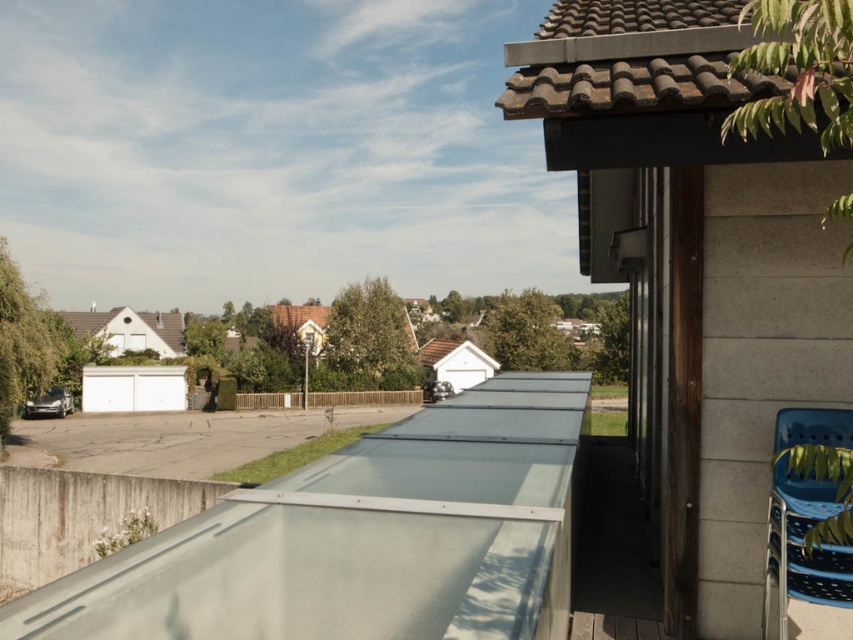
Question: Is blue plastic chair at lower right to the left of brown wooden fence at center from the viewer's perspective?

Choices:
 (A) yes
 (B) no

Answer: (B)

Question: Observing the image, what is the correct spatial positioning of blue plastic chair at lower right in reference to brown wooden fence at center?

Choices:
 (A) right
 (B) left

Answer: (A)

Question: Which point is closer to the camera?

Choices:
 (A) (402, 392)
 (B) (810, 481)
 (C) (271, 547)

Answer: (C)

Question: Is blue plastic chair at lower right smaller than brown wooden fence at center?

Choices:
 (A) yes
 (B) no

Answer: (A)

Question: Among these points, which one is nearest to the camera?

Choices:
 (A) (792, 595)
 (B) (439, 552)
 (C) (370, 392)

Answer: (B)

Question: Among these objects, which one is nearest to the camera?

Choices:
 (A) transparent glass balcony at lower center
 (B) blue plastic chair at lower right
 (C) brown wooden fence at center

Answer: (B)